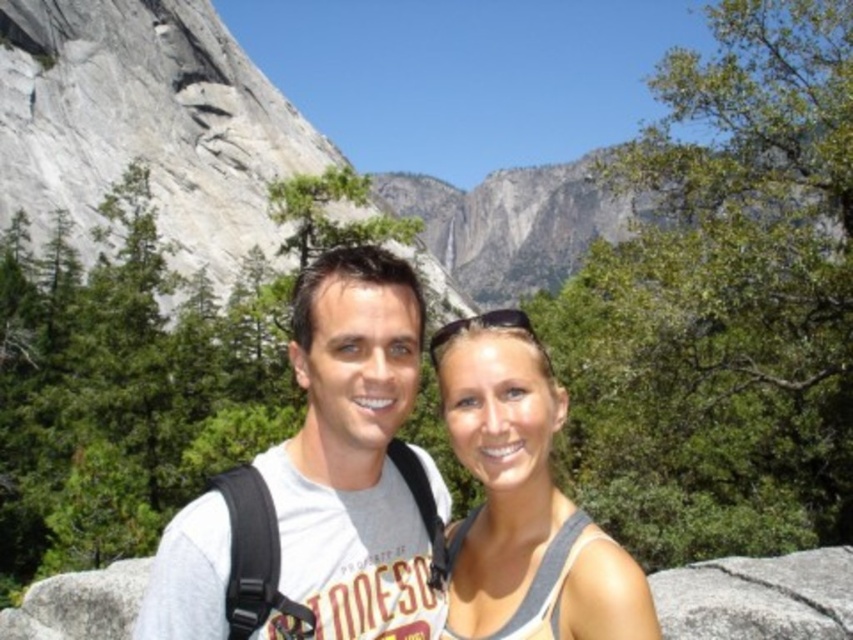
Which is in front, point (1, 48) or point (546, 536)?

Positioned in front is point (546, 536).

Can you confirm if gray granite mountain at upper left is positioned to the right of matte gray tank top at center?

Incorrect, gray granite mountain at upper left is not on the right side of matte gray tank top at center.

Between point (199, 125) and point (607, 632), which one is positioned in front?

Point (607, 632) is in front.

I want to click on gray granite mountain at upper left, so click(144, 124).

Is point (379, 408) closer to camera compared to point (506, 586)?

That is False.

Where is `white cotton t-shirt at center`? white cotton t-shirt at center is located at coordinates (352, 452).

Where is `white cotton t-shirt at center`? white cotton t-shirt at center is located at coordinates (352, 452).

Which of these two, gray granite mountain at upper left or white cotton t-shirt at center, stands taller?

Standing taller between the two is gray granite mountain at upper left.

You are a GUI agent. You are given a task and a screenshot of the screen. Output one action in this format:
    pyautogui.click(x=<x>, y=<y>)
    Task: Click on the gray granite mountain at upper left
    This screenshot has height=640, width=853.
    Given the screenshot: What is the action you would take?
    pyautogui.click(x=144, y=124)

Does point (213, 90) lie behind point (201, 538)?

That is True.

Identify the location of gray granite mountain at upper left. The height and width of the screenshot is (640, 853). (144, 124).